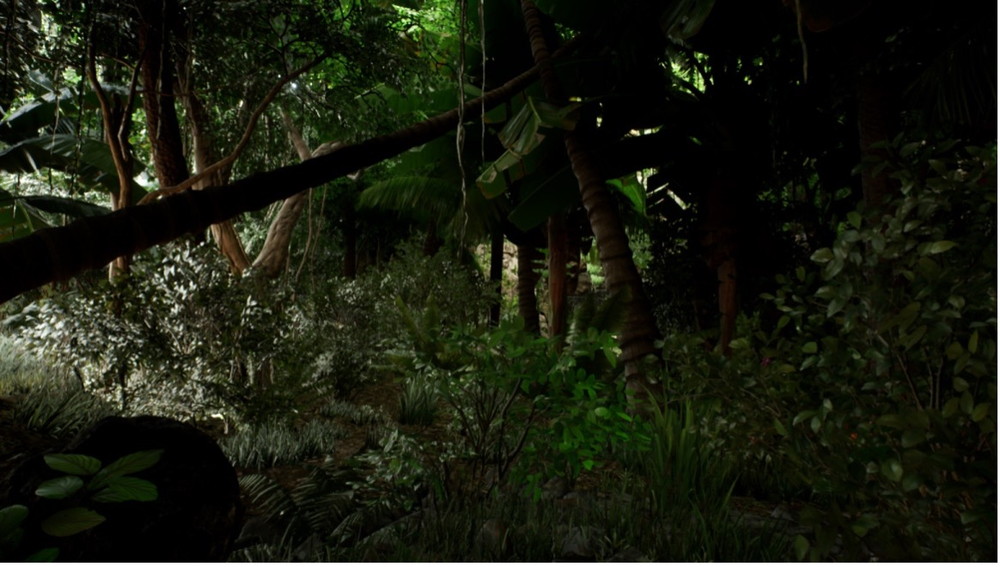
This screenshot has width=1000, height=567. Identify the location of plant in sunlight. (95, 342), (178, 314), (70, 318).